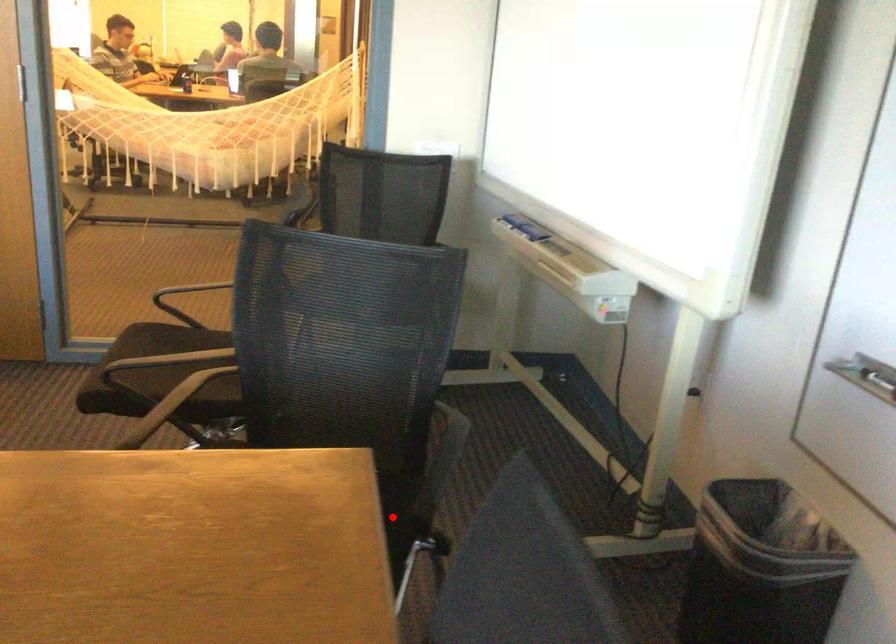
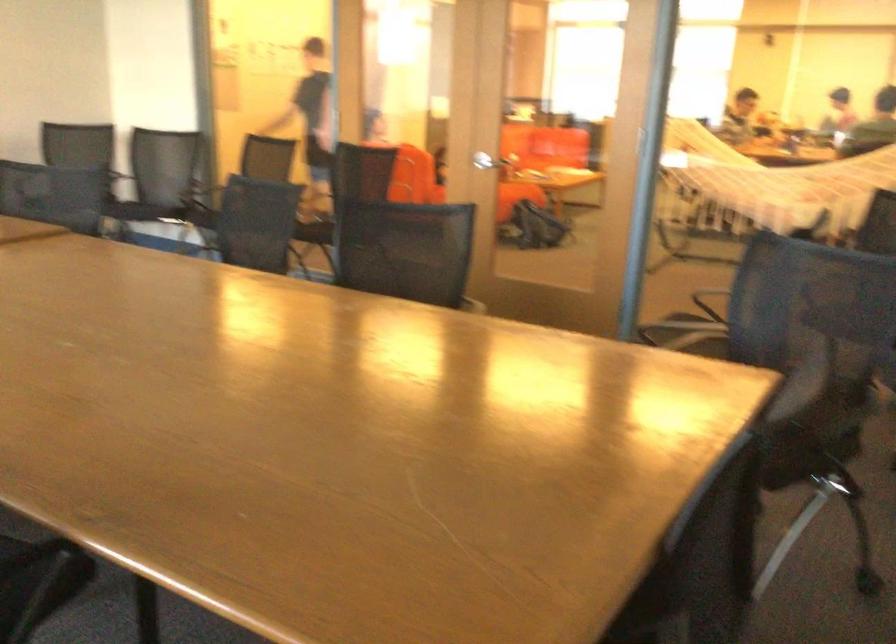
Question: I am providing you with two images of the same scene from different viewpoints. A red point is shown in image1. For the corresponding object point in image2, is it positioned nearer or farther from the camera?

Choices:
 (A) Nearer
 (B) Farther

Answer: (B)